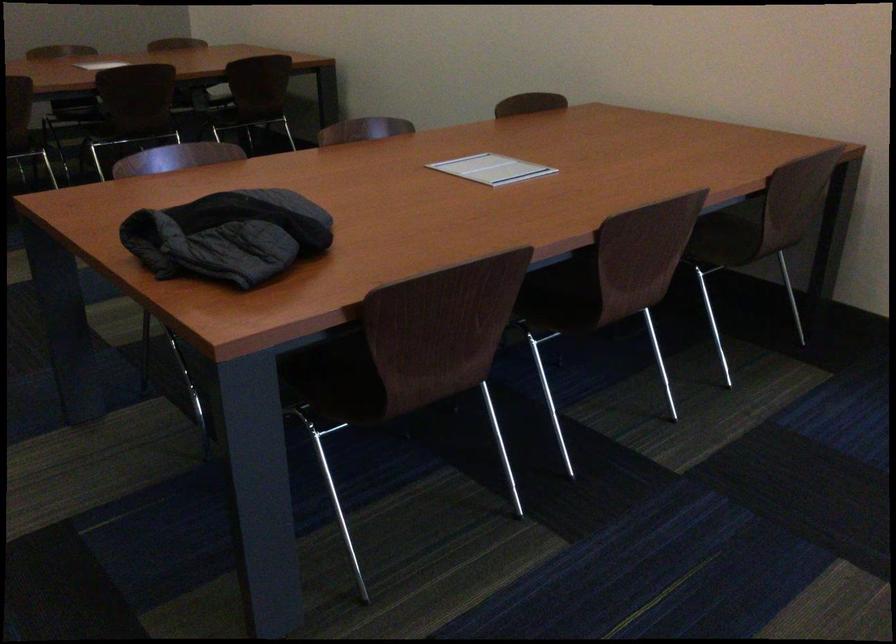
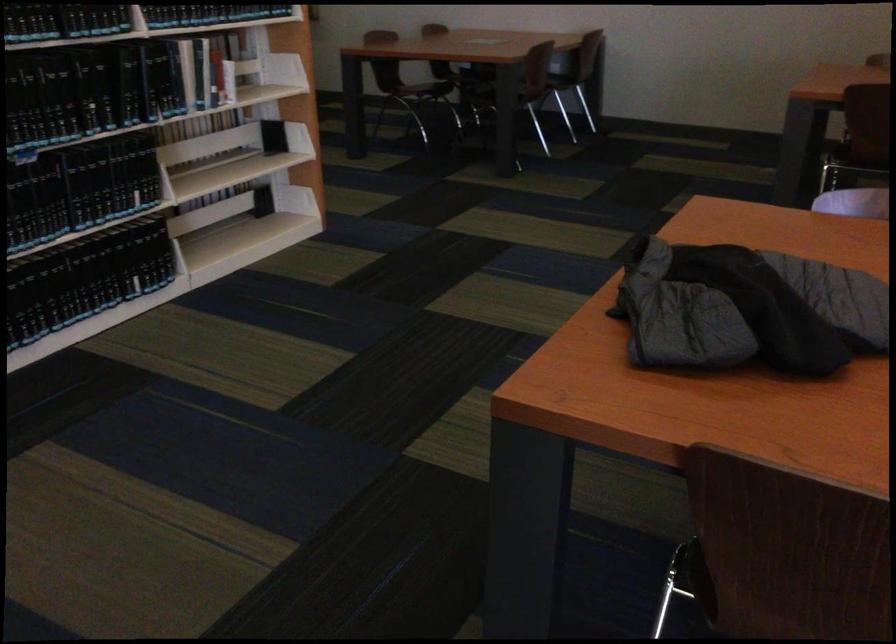
Question: The camera is either moving clockwise (left) or counter-clockwise (right) around the object. The first image is from the beginning of the video and the second image is from the end. Is the camera moving left or right when shooting the video?

Choices:
 (A) Left
 (B) Right

Answer: (B)